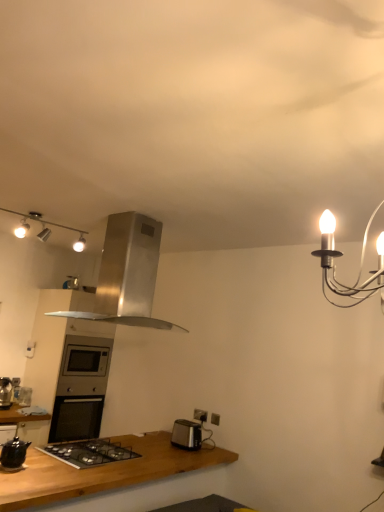
Question: Considering the relative positions of satin silver oven at center and matte silver track lights at upper left in the image provided, is satin silver oven at center to the right of matte silver track lights at upper left from the viewer's perspective?

Choices:
 (A) no
 (B) yes

Answer: (A)

Question: Considering the relative sizes of satin silver oven at center and matte silver track lights at upper left in the image provided, is satin silver oven at center wider than matte silver track lights at upper left?

Choices:
 (A) yes
 (B) no

Answer: (A)

Question: From a real-world perspective, is satin silver oven at center over matte silver track lights at upper left?

Choices:
 (A) no
 (B) yes

Answer: (A)

Question: Could you tell me if satin silver oven at center is facing matte silver track lights at upper left?

Choices:
 (A) no
 (B) yes

Answer: (A)

Question: From the image's perspective, does satin silver oven at center appear higher than matte silver track lights at upper left?

Choices:
 (A) no
 (B) yes

Answer: (A)

Question: From the image's perspective, is satin silver toaster at lower center above or below satin silver oven at center?

Choices:
 (A) below
 (B) above

Answer: (A)

Question: From a real-world perspective, is satin silver toaster at lower center positioned above or below satin silver oven at center?

Choices:
 (A) below
 (B) above

Answer: (A)

Question: In the image, is satin silver toaster at lower center on the left side or the right side of satin silver oven at center?

Choices:
 (A) right
 (B) left

Answer: (A)

Question: Looking at their shapes, would you say satin silver toaster at lower center is wider or thinner than satin silver oven at center?

Choices:
 (A) thin
 (B) wide

Answer: (A)

Question: Considering the positions of satin silver oven at center and brushed metal toaster at lower left in the image, is satin silver oven at center wider or thinner than brushed metal toaster at lower left?

Choices:
 (A) wide
 (B) thin

Answer: (A)

Question: Considering the positions of satin silver oven at center and brushed metal toaster at lower left in the image, is satin silver oven at center bigger or smaller than brushed metal toaster at lower left?

Choices:
 (A) big
 (B) small

Answer: (A)

Question: From a real-world perspective, is satin silver oven at center above or below brushed metal toaster at lower left?

Choices:
 (A) below
 (B) above

Answer: (B)

Question: Is satin silver oven at center taller or shorter than brushed metal toaster at lower left?

Choices:
 (A) short
 (B) tall

Answer: (B)

Question: In the image, is brushed metal toaster at lower left positioned in front of or behind black matte gas stove at lower left?

Choices:
 (A) front
 (B) behind

Answer: (B)

Question: Is brushed metal toaster at lower left taller or shorter than black matte gas stove at lower left?

Choices:
 (A) tall
 (B) short

Answer: (A)